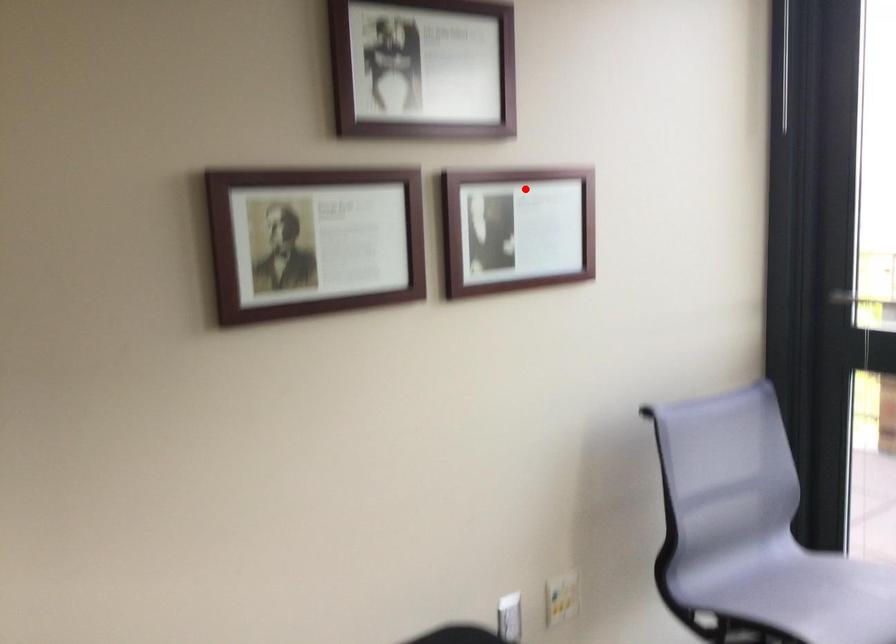
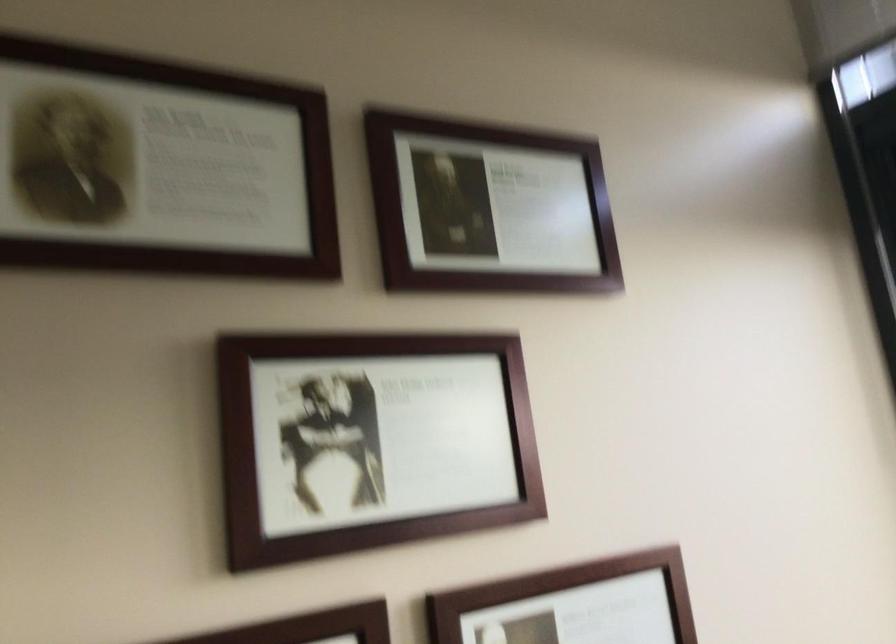
Question: I am providing you with two images of the same scene from different viewpoints. Given a red point in image1, look at the same physical point in image2. Is it:

Choices:
 (A) Closer to the viewpoint
 (B) Farther from the viewpoint

Answer: (A)